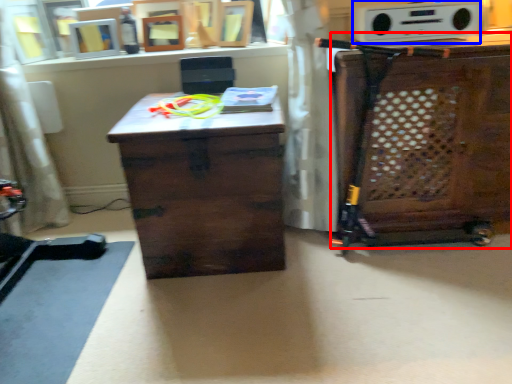
Question: Which point is closer to the camera, cabinetry (highlighted by a red box) or stereo (highlighted by a blue box)?

Choices:
 (A) cabinetry
 (B) stereo

Answer: (A)